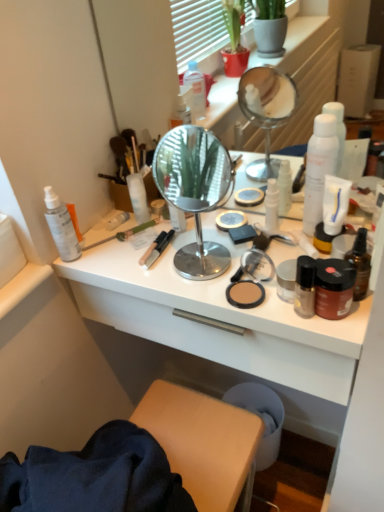
This screenshot has width=384, height=512. Identify the location of free area in between white matte spray can at left, the seventh toiletry in the right-to-left sequence, and satin black nail polish at right, which appears as the sixth toiletry when viewed from the left. (169, 276).